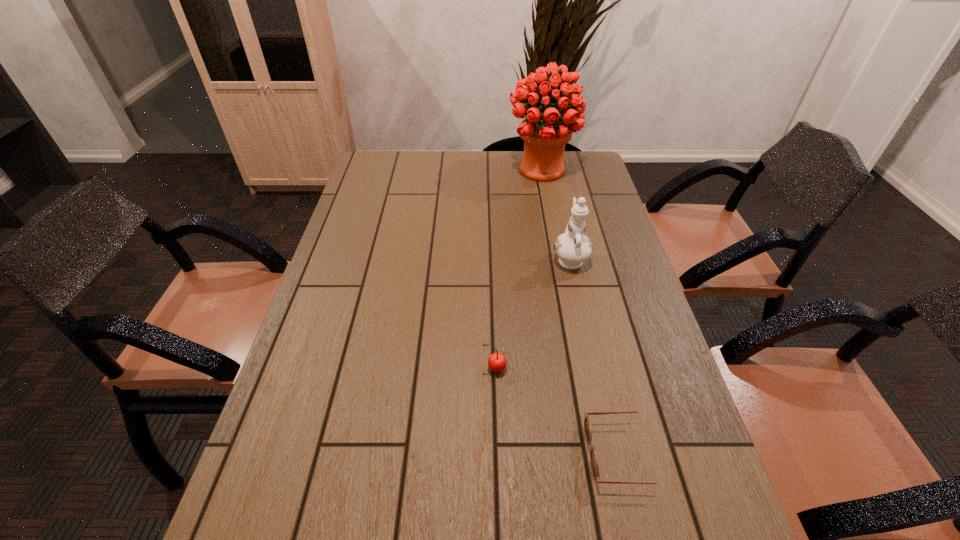
Locate an element on the screen. This screenshot has height=540, width=960. the farthest object is located at coordinates (545, 132).

Where is `the tallest object`? This screenshot has width=960, height=540. the tallest object is located at coordinates (545, 132).

The width and height of the screenshot is (960, 540). Find the location of `the second farthest object`. the second farthest object is located at coordinates (572, 247).

Find the location of a particular element. The height and width of the screenshot is (540, 960). chinaware is located at coordinates (572, 247).

Identify the location of the third tallest object. (497, 362).

Find the location of a particular element. Image resolution: width=960 pixels, height=540 pixels. the third farthest object is located at coordinates (497, 362).

Find the location of a particular element. The image size is (960, 540). the shortest object is located at coordinates (587, 426).

The height and width of the screenshot is (540, 960). I want to click on sunglasses, so click(587, 426).

This screenshot has width=960, height=540. What are the coordinates of `free space located 0.080m on the left of the bouquet` in the screenshot? It's located at (485, 170).

I want to click on vacant space located 0.090m at the spout of the third nearest object, so click(x=563, y=225).